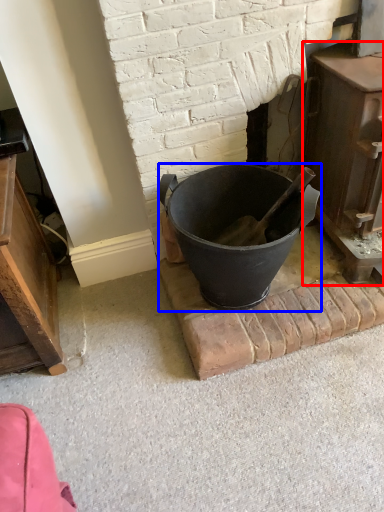
Question: Among these objects, which one is nearest to the camera, fireplace (highlighted by a red box) or bucket (highlighted by a blue box)?

Choices:
 (A) fireplace
 (B) bucket

Answer: (A)